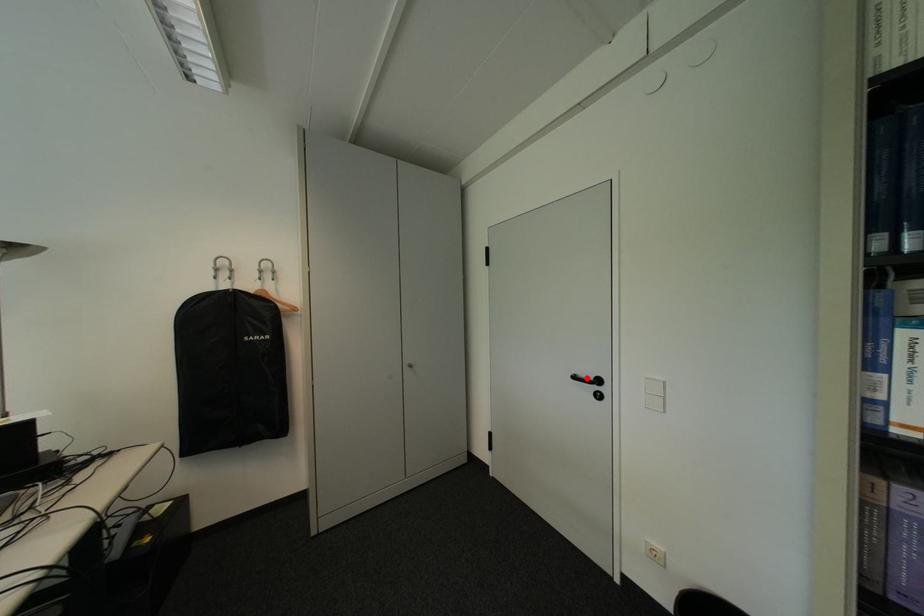
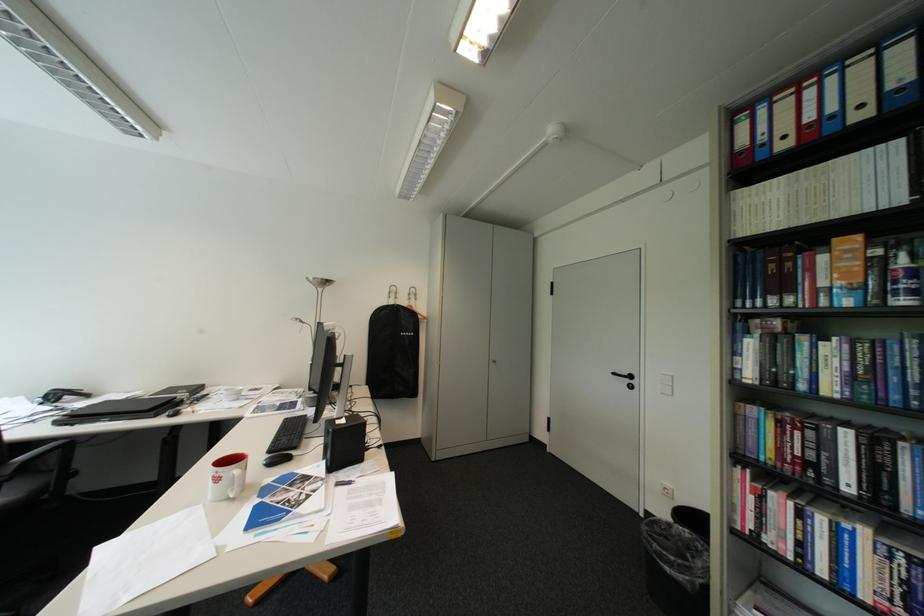
In the second image, find the point that corresponds to the highlighted location in the first image.

(626, 374)